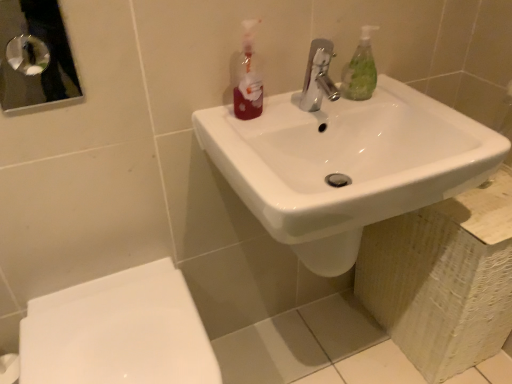
Locate an element on the screen. vacant area that is situated to the right of translucent plastic bottle at upper center is located at coordinates (294, 112).